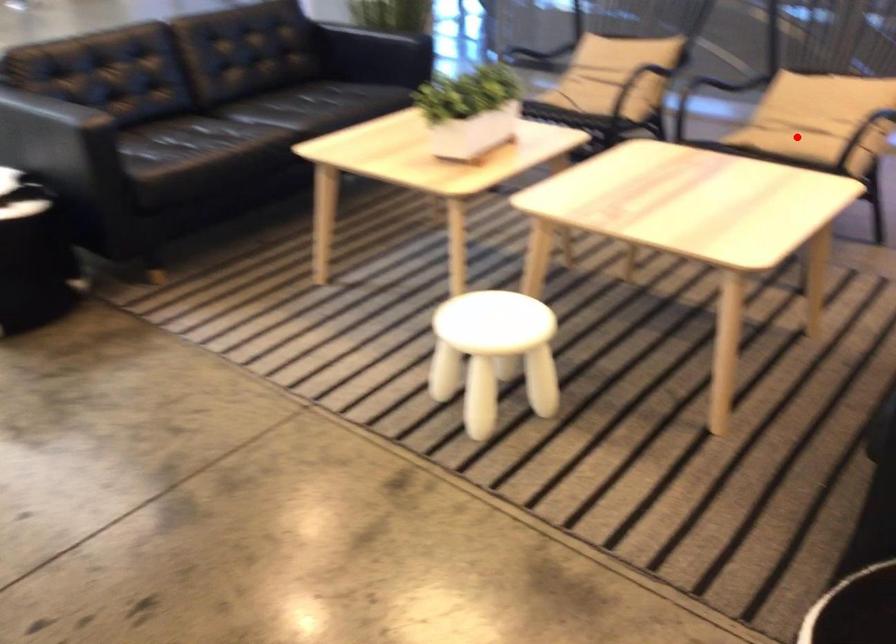
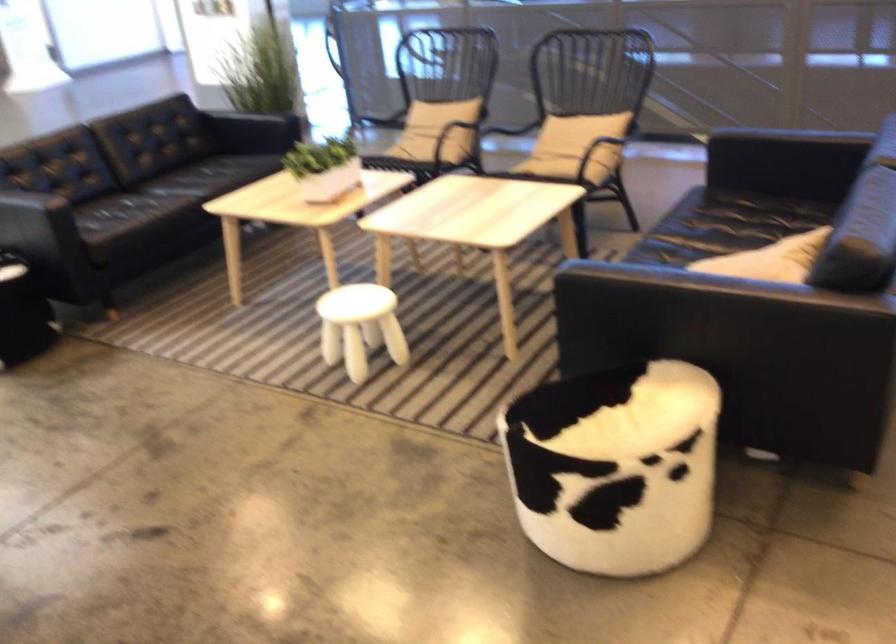
Find the pixel in the second image that matches the highlighted location in the first image.

(552, 160)